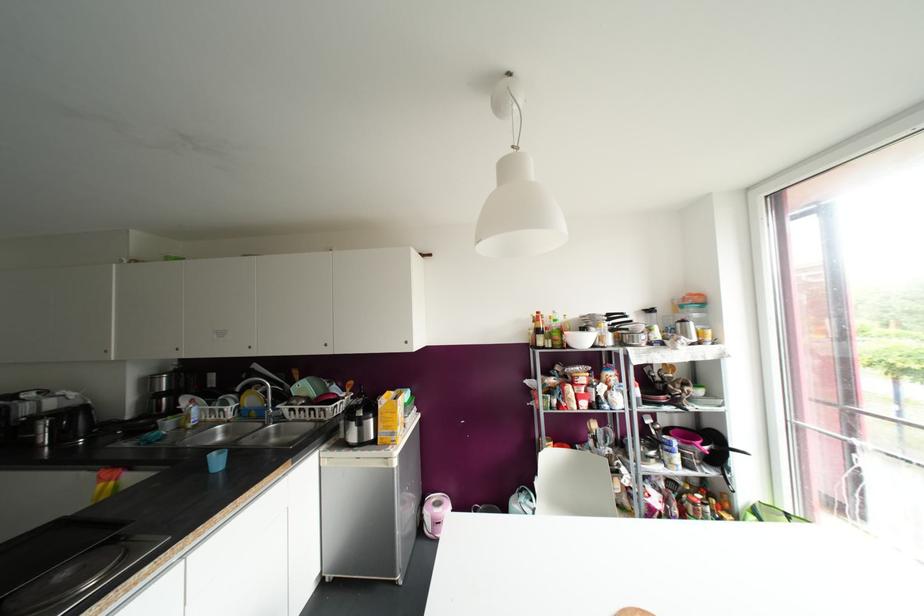
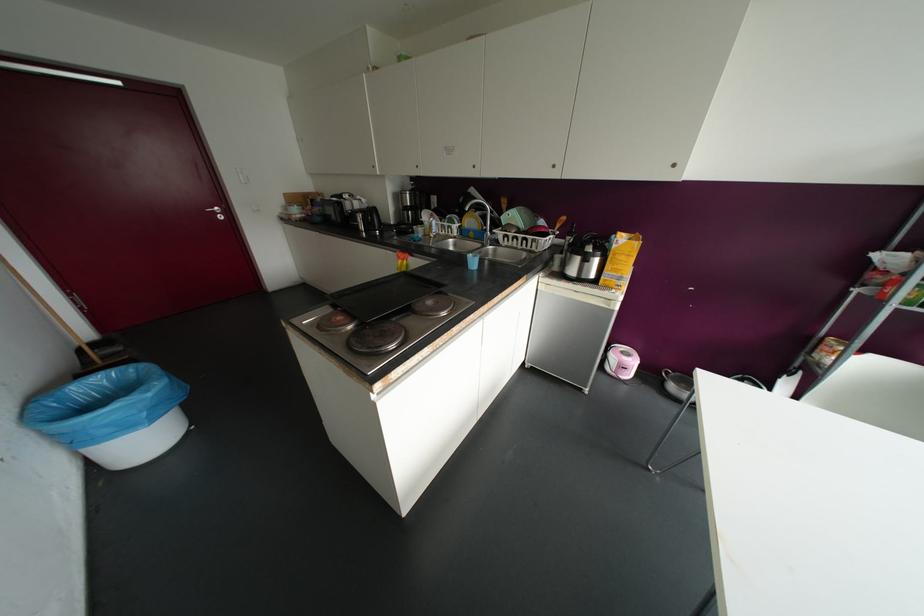
Where in the second image is the point corresponding to point 116,525 from the first image?

(441, 284)